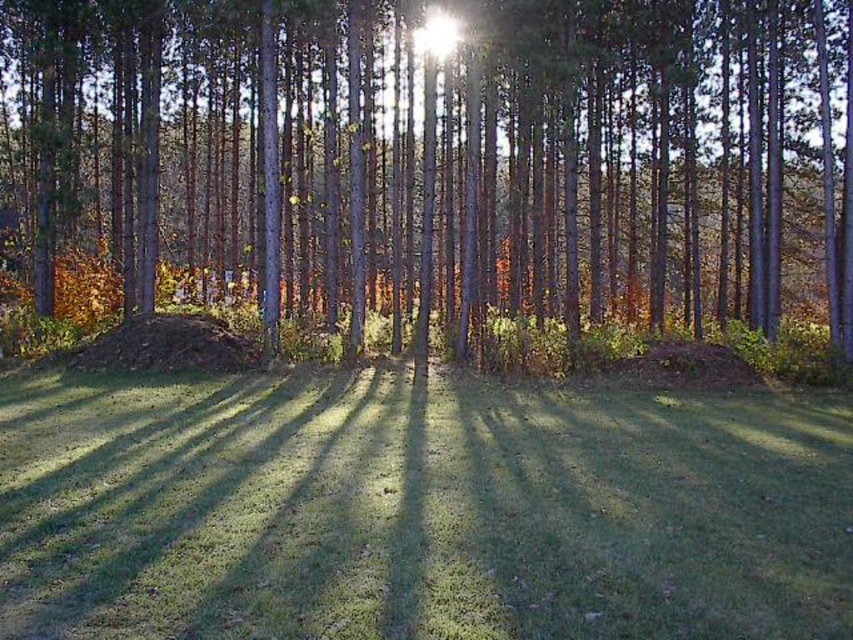
You are standing in the middle of the forest clearing and notice the green matte tree at center and the green grass at center. Which of these two objects is wider in terms of their physical dimensions?

The green matte tree at center is wider than the green grass at center.